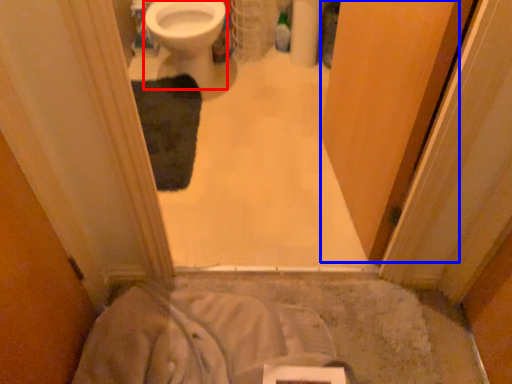
Question: Which of the following is the closest to the observer, bidet (highlighted by a red box) or screen door (highlighted by a blue box)?

Choices:
 (A) bidet
 (B) screen door

Answer: (B)